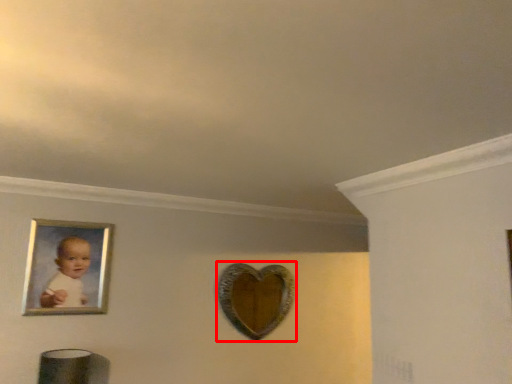
Question: Where is mirror (annotated by the red box) located in relation to picture frame in the image?

Choices:
 (A) right
 (B) left

Answer: (A)